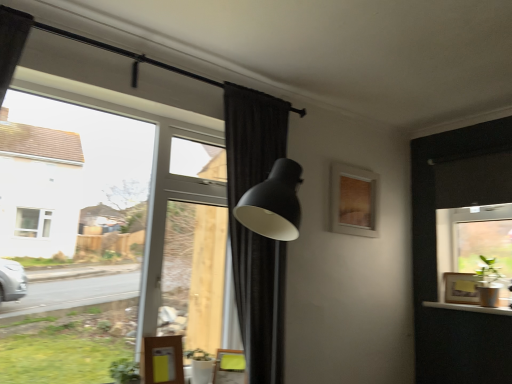
Question: Is wooden picture frame at right, the 2th picture frame positioned from the top, bigger or smaller than yellow wood door at lower left?

Choices:
 (A) small
 (B) big

Answer: (A)

Question: Is point (471, 301) positioned closer to the camera than point (153, 344)?

Choices:
 (A) closer
 (B) farther

Answer: (B)

Question: Which of these objects is positioned closest to the transparent glass window at upper left, which is counted as the 2th window, starting from the right?

Choices:
 (A) clear glass window at right, the 2th window in the left-to-right sequence
 (B) yellow fabric swivel chair at lower center
 (C) green matte plant at lower left
 (D) black matte curtain at center
 (E) white glossy window sill at lower right

Answer: (C)

Question: Which object is the closest to the yellow wood door at lower left?

Choices:
 (A) white glossy window sill at lower right
 (B) clear glass window at right, which is the first window in right-to-left order
 (C) yellow fabric swivel chair at lower center
 (D) wooden frame at upper right, arranged as the first picture frame when viewed from the top
 (E) green matte plant at right

Answer: (C)